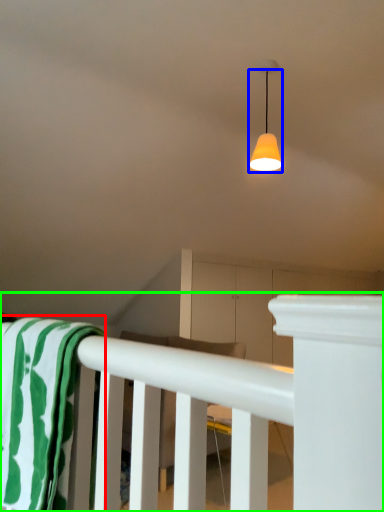
Question: Which object is the farthest from beach towel (highlighted by a red box)? Choose among these: lamp (highlighted by a blue box) or rail (highlighted by a green box).

Choices:
 (A) lamp
 (B) rail

Answer: (A)